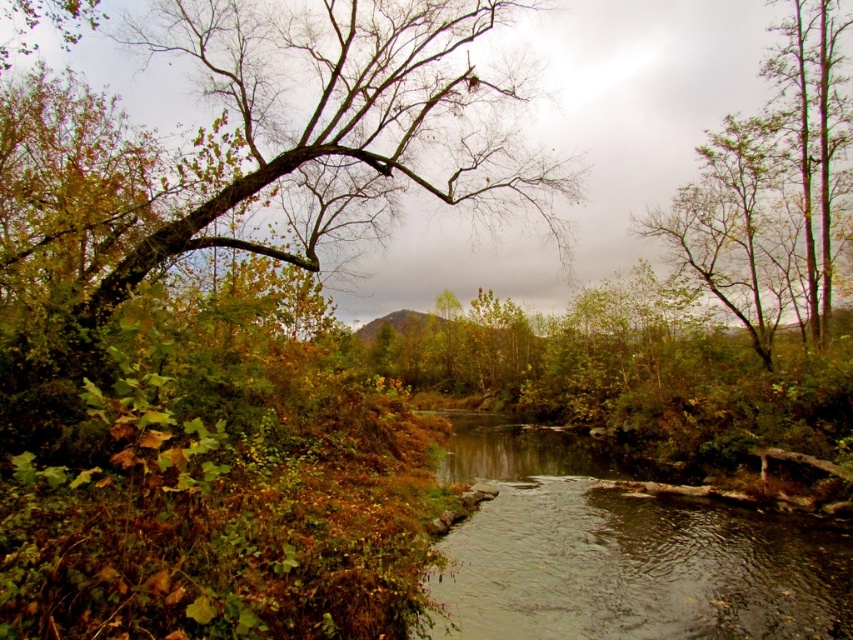
Question: Considering the relative positions of green leafy tree at left and brown liquid water at lower center in the image provided, where is green leafy tree at left located with respect to brown liquid water at lower center?

Choices:
 (A) left
 (B) right

Answer: (A)

Question: Which object is closer to the camera taking this photo?

Choices:
 (A) brown liquid water at lower center
 (B) green leafy tree at left

Answer: (A)

Question: Which point is farther to the camera?

Choices:
 (A) brown liquid water at lower center
 (B) green leafy tree at left

Answer: (B)

Question: Which of the following is the farthest from the observer?

Choices:
 (A) 82,257
 (B) 459,624

Answer: (A)

Question: From the image, what is the correct spatial relationship of green leafy tree at left in relation to brown liquid water at lower center?

Choices:
 (A) right
 (B) left

Answer: (B)

Question: Is green leafy tree at left bigger than brown liquid water at lower center?

Choices:
 (A) yes
 (B) no

Answer: (A)